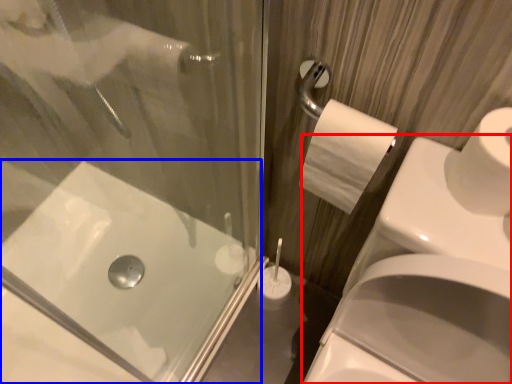
Question: Among these objects, which one is farthest to the camera, sink (highlighted by a red box) or bath (highlighted by a blue box)?

Choices:
 (A) sink
 (B) bath

Answer: (B)